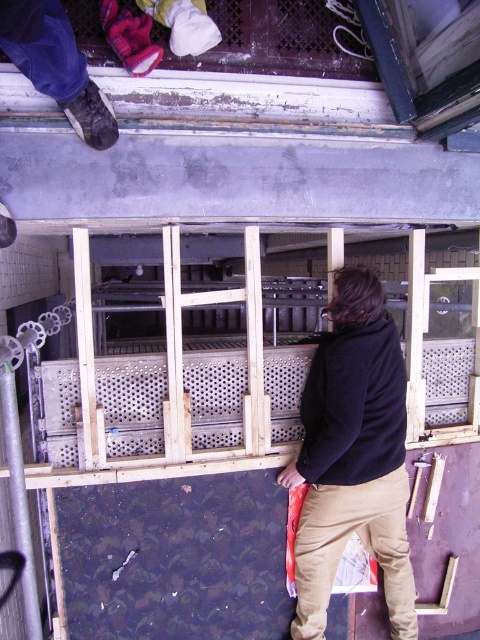
Is black fleece jacket at center to the left of black fleece sweatshirt at center from the viewer's perspective?

Indeed, black fleece jacket at center is positioned on the left side of black fleece sweatshirt at center.

From the picture: Which is more to the left, black fleece jacket at center or black fleece sweatshirt at center?

black fleece jacket at center is more to the left.

Who is more forward, [357,385] or [387,470]?

Point [357,385]

Where is `black fleece jacket at center`? This screenshot has height=640, width=480. black fleece jacket at center is located at coordinates [x=352, y=456].

Does black fleece jacket at center appear on the left side of wooden frame at upper center?

In fact, black fleece jacket at center is to the right of wooden frame at upper center.

Is black fleece jacket at center to the right of wooden frame at upper center from the viewer's perspective?

Correct, you'll find black fleece jacket at center to the right of wooden frame at upper center.

Is point (349, 417) more distant than point (468, 106)?

Yes, it is.

Where is `black fleece jacket at center`? The image size is (480, 640). black fleece jacket at center is located at coordinates (352, 456).

Is point (204, 54) farther from viewer compared to point (338, 456)?

No, it is in front of (338, 456).

Which is below, wooden frame at upper center or black fleece sweatshirt at center?

black fleece sweatshirt at center is below.

In order to click on wooden frame at upper center in this screenshot , I will do `click(372, 83)`.